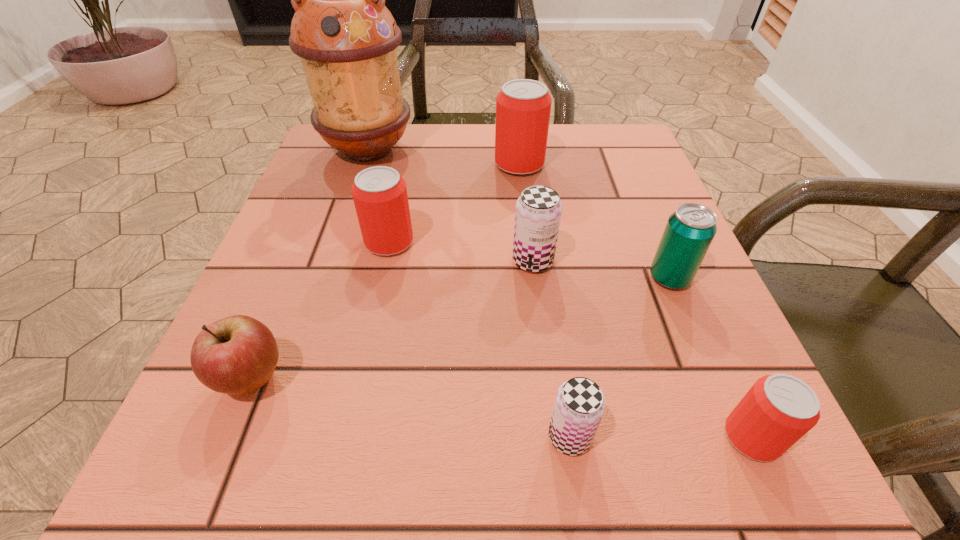
The height and width of the screenshot is (540, 960). In the image, there is a desktop. Find the location of `vacant space at the right edge`. vacant space at the right edge is located at coordinates (601, 229).

The height and width of the screenshot is (540, 960). Find the location of `vacant space at the near left corner of the desktop`. vacant space at the near left corner of the desktop is located at coordinates (242, 433).

Locate an element on the screen. Image resolution: width=960 pixels, height=540 pixels. free location at the far right corner of the desktop is located at coordinates (625, 130).

The height and width of the screenshot is (540, 960). I want to click on vacant region at the near right corner of the desktop, so (725, 470).

At what (x,y) coordinates should I click in order to perform the action: click on free point between the red apple and the nearest red beer can. Please return your answer as a coordinate pair (x, y). This screenshot has height=540, width=960. Looking at the image, I should click on (502, 408).

This screenshot has height=540, width=960. In order to click on unoccupied position between the red apple and the second red beer can from left to right in this screenshot , I will do coord(386,271).

In order to click on vacant area that lies between the third nearest object and the second smallest red beer can in this screenshot , I will do `click(322, 310)`.

In order to click on unoccupied position between the bigger purple beer can and the rightmost red beer can in this screenshot , I will do `click(642, 349)`.

Where is `blank region between the nearest red beer can and the teal beer can`? This screenshot has height=540, width=960. blank region between the nearest red beer can and the teal beer can is located at coordinates (710, 357).

Locate an element on the screen. Image resolution: width=960 pixels, height=540 pixels. vacant area between the smaller purple beer can and the tallest object is located at coordinates [469, 293].